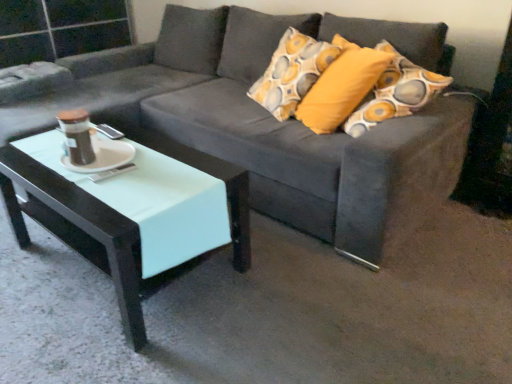
Locate an element on the screen. The height and width of the screenshot is (384, 512). blank space situated above mint glossy coffee table at lower left (from a real-world perspective) is located at coordinates coord(104,164).